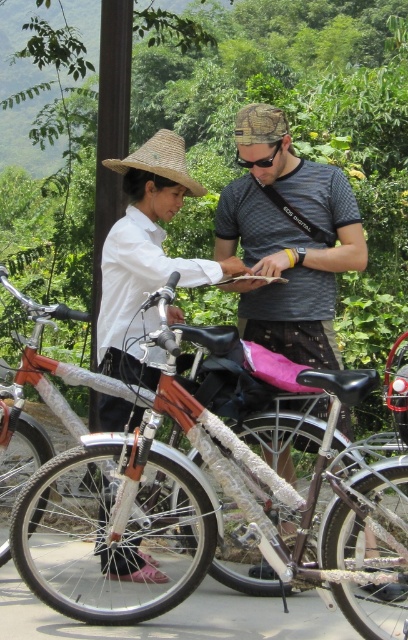
You are standing at the point marked by the coordinates point [206,499]. Looking around, you see a shiny metallic bicycle at center. Which direction should you face to see the person on the left?

Since the point [206,499] is on the shiny metallic bicycle at center, you should face towards the left to see the person on the left.

You are trying to decide which object to pick up first between the shiny metallic bicycle at center and the matte straw hat at center. Which one is larger?

The shiny metallic bicycle at center is bigger than the matte straw hat at center, so you should pick up the shiny metallic bicycle at center first.